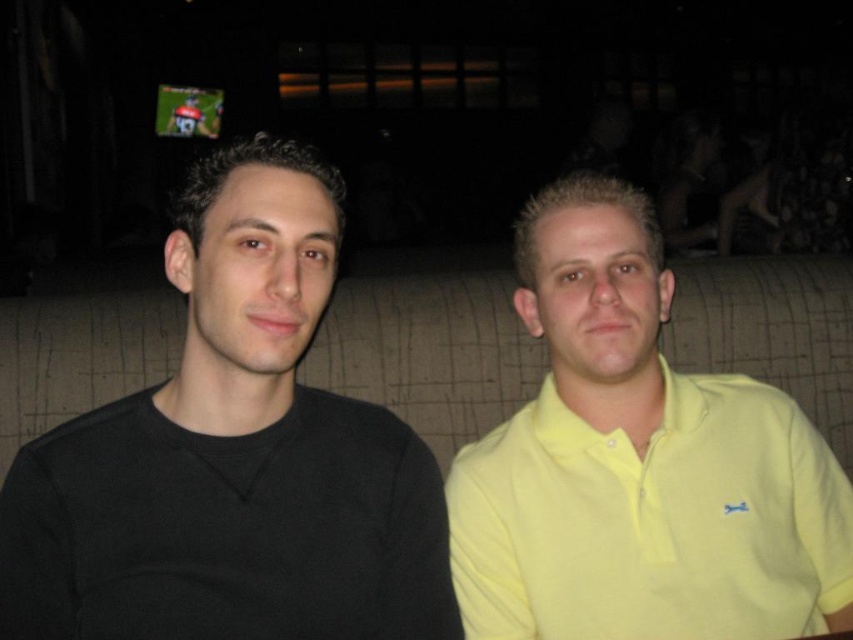
You are a tailor who needs to determine which garment requires more fabric to alter. You have two garments in front of you, the black matte sweater at left and the yellow matte shirt at right. Based on their sizes, which one would need more fabric for alterations?

The black matte sweater at left is larger in size than the yellow matte shirt at right, so it would require more fabric for alterations.

You are a photographer trying to capture a clear photo of both the black matte sweater at left and the yellow matte shirt at right. Since you want both subjects to be in focus, which one should you adjust your camera focus to prioritize first?

The black matte sweater at left is closer to the viewer than the yellow matte shirt at right. To ensure both are in focus, prioritize focusing on the black matte sweater at left first, as it is nearer, and adjust the depth of field accordingly.

In the scene shown: You are a photographer trying to capture a candid shot of both the black matte sweater at left and the yellow matte shirt at right. Since you want to ensure both are fully visible in the frame, which direction should you position your camera relative to the subjects?

You should position your camera to the right side of the subjects because the black matte sweater at left is to the left of the yellow matte shirt at right, so facing the right side will ensure both are fully visible in the frame.